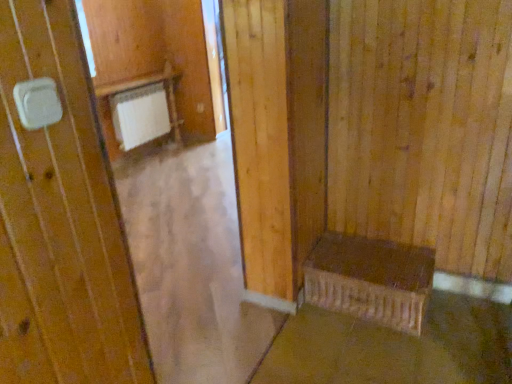
Question: Is brown concrete at lower right bigger than brown wooden bench at lower right?

Choices:
 (A) no
 (B) yes

Answer: (A)

Question: Considering the relative sizes of brown concrete at lower right and brown wooden bench at lower right in the image provided, is brown concrete at lower right thinner than brown wooden bench at lower right?

Choices:
 (A) yes
 (B) no

Answer: (B)

Question: Is brown concrete at lower right outside brown wooden bench at lower right?

Choices:
 (A) no
 (B) yes

Answer: (B)

Question: Does brown concrete at lower right come in front of brown wooden bench at lower right?

Choices:
 (A) no
 (B) yes

Answer: (B)

Question: Is brown concrete at lower right surrounding brown wooden bench at lower right?

Choices:
 (A) yes
 (B) no

Answer: (B)

Question: From the image's perspective, would you say brown concrete at lower right is positioned over brown wooden bench at lower right?

Choices:
 (A) no
 (B) yes

Answer: (A)

Question: From the image's perspective, is brown wooden bench at lower right on brown concrete at lower right?

Choices:
 (A) no
 (B) yes

Answer: (B)

Question: Does brown wooden bench at lower right have a greater height compared to brown concrete at lower right?

Choices:
 (A) yes
 (B) no

Answer: (A)

Question: Can you confirm if brown wooden bench at lower right is wider than brown concrete at lower right?

Choices:
 (A) yes
 (B) no

Answer: (B)

Question: Is brown wooden bench at lower right at the right side of brown concrete at lower right?

Choices:
 (A) yes
 (B) no

Answer: (B)

Question: Is brown wooden bench at lower right placed right next to brown concrete at lower right?

Choices:
 (A) no
 (B) yes

Answer: (A)

Question: From a real-world perspective, is brown wooden bench at lower right located higher than brown concrete at lower right?

Choices:
 (A) yes
 (B) no

Answer: (A)

Question: From the image's perspective, is brown concrete at lower right located above or below brown wooden bench at lower right?

Choices:
 (A) above
 (B) below

Answer: (B)